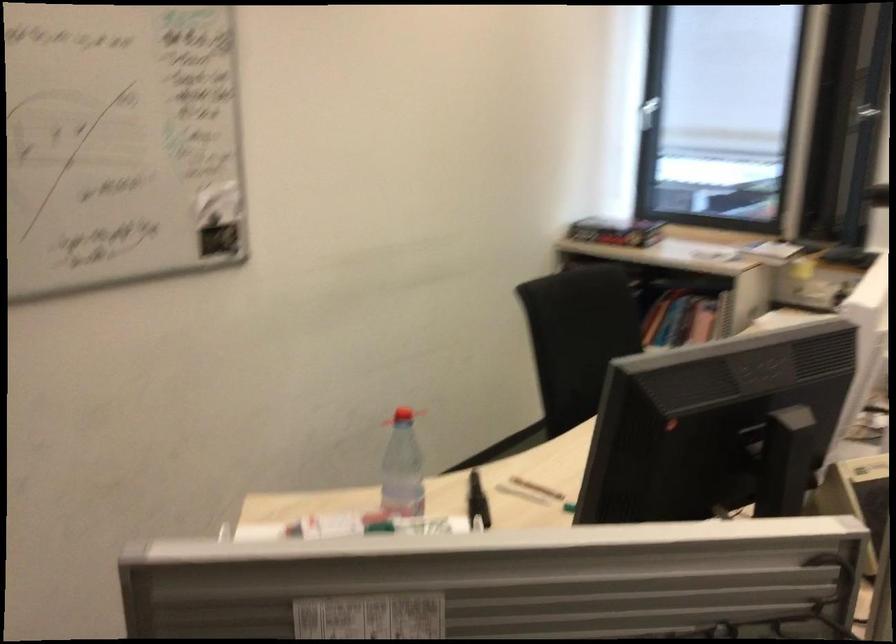
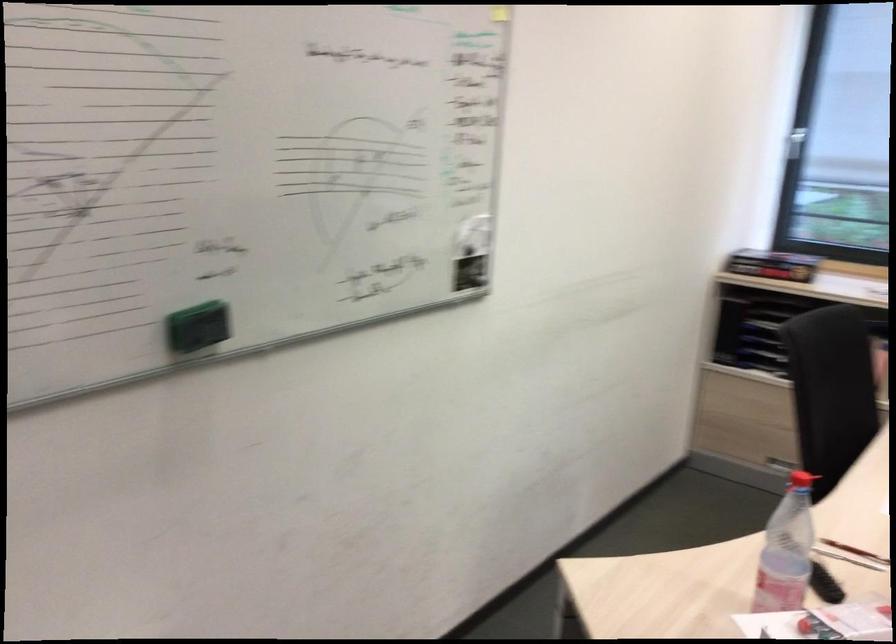
Question: The images are taken continuously from a first-person perspective. In which direction is your viewpoint rotating?

Choices:
 (A) Left
 (B) Right
 (C) Up
 (D) Down

Answer: (C)